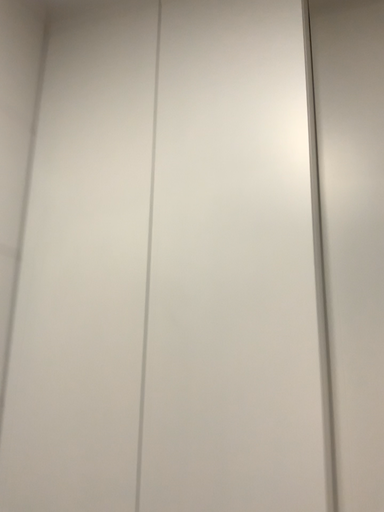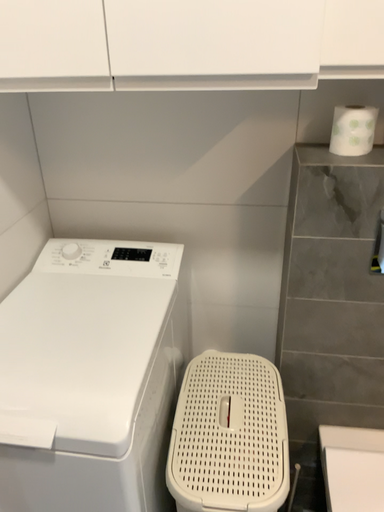
Question: Which way did the camera rotate in the video?

Choices:
 (A) rotated downward
 (B) rotated upward

Answer: (A)